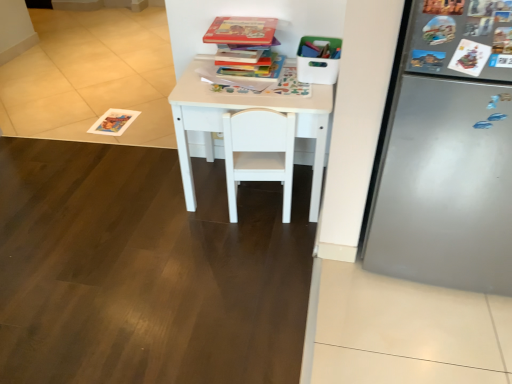
Locate an element on the screen. Image resolution: width=512 pixels, height=384 pixels. free space that is to the left of white matte chair at center is located at coordinates (190, 218).